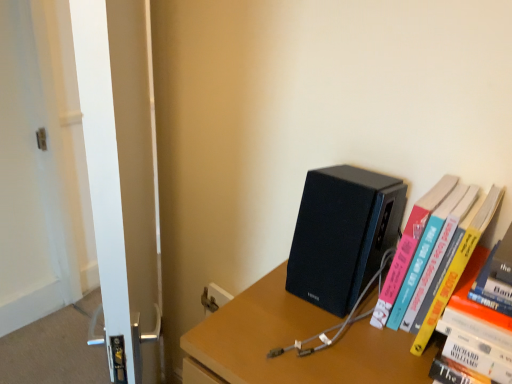
Locate an element on the screen. This screenshot has height=384, width=512. vacant region to the left of hardcover book at right is located at coordinates (315, 329).